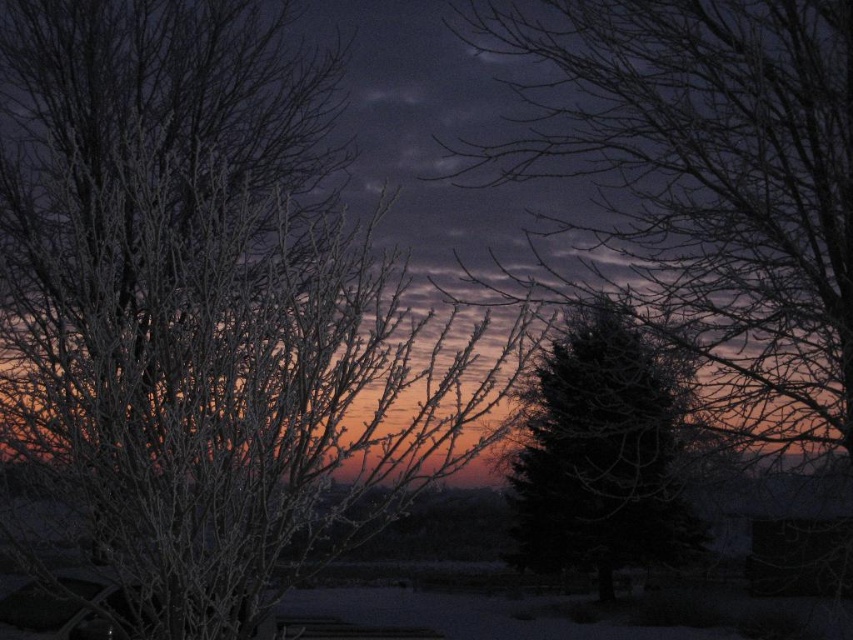
Is frosted white branches at left shorter than green matte tree at center?

No.

Does point (122, 164) come closer to viewer compared to point (521, 557)?

Yes.

Where is `frosted white branches at left`? This screenshot has width=853, height=640. frosted white branches at left is located at coordinates (200, 301).

The width and height of the screenshot is (853, 640). Describe the element at coordinates (705, 182) in the screenshot. I see `frosted branches at center` at that location.

Can you confirm if frosted branches at center is positioned below green matte tree at center?

No, frosted branches at center is not below green matte tree at center.

Which is in front, point (762, 138) or point (596, 472)?

Point (762, 138)

Find the location of `frosted branches at center`. frosted branches at center is located at coordinates (705, 182).

Consider the image. Who is more forward, (286, 577) or (778, 285)?

Point (286, 577) is more forward.

From the picture: Can you confirm if frosted white branches at left is shorter than frosted branches at center?

Incorrect, frosted white branches at left's height does not fall short of frosted branches at center's.

Does point (28, 276) come in front of point (811, 333)?

No.

You are a GUI agent. You are given a task and a screenshot of the screen. Output one action in this format:
    pyautogui.click(x=<x>, y=<y>)
    Task: Click on the frosted white branches at left
    Image resolution: width=853 pixels, height=640 pixels.
    Given the screenshot: What is the action you would take?
    pyautogui.click(x=200, y=301)